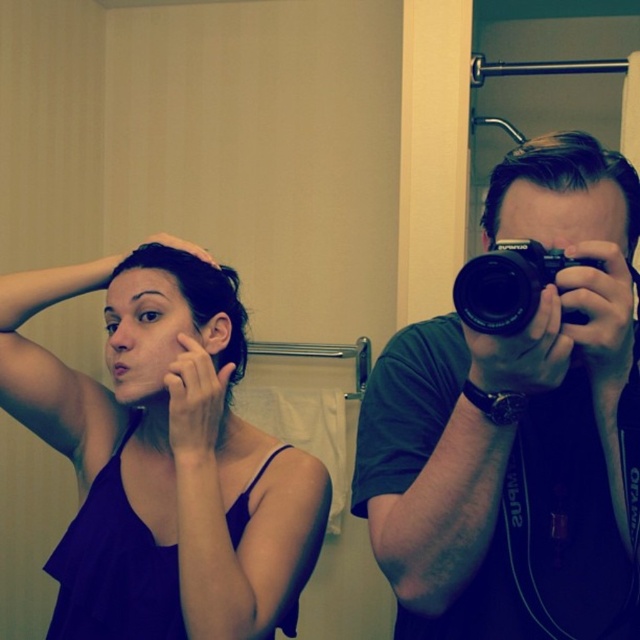
You are trying to decide which camera to use for a photo shoot. You see a black matte camera at right and a black plastic camera at center. Which camera is located to the right of the other?

The black matte camera at right is positioned on the right side of the black plastic camera at center.

Based on the photo, you are trying to decide where to place a new plant in the bathroom. The plant needs to be placed between the black matte camera at right and the purple matte tank top at upper left. Based on their heights, which object should the plant be placed closer to?

The plant should be placed closer to the purple matte tank top at upper left because the black matte camera at right is much taller than the purple matte tank top at upper left, so the tank top is shorter and the plant would need to be lower to be between them.